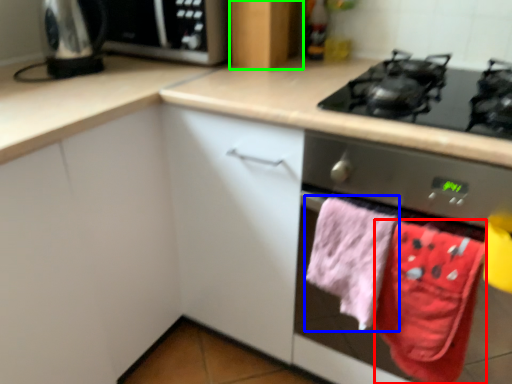
Question: Which object is positioned closest to beach towel (highlighted by a red box)? Select from beach towel (highlighted by a blue box) and cabinetry (highlighted by a green box).

Choices:
 (A) beach towel
 (B) cabinetry

Answer: (A)